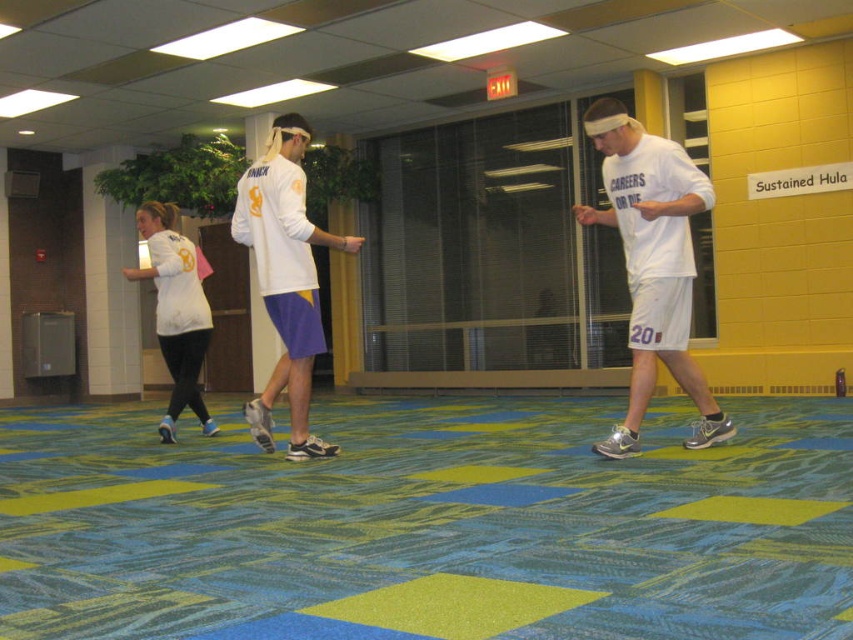
Question: Estimate the real-world distances between objects in this image. Which object is closer to the white matte shirt at left?

Choices:
 (A) white matte jersey at center
 (B) white matte shorts at center

Answer: (A)

Question: Does white matte shorts at center appear on the left side of white matte shirt at left?

Choices:
 (A) no
 (B) yes

Answer: (A)

Question: Which of the following is the closest to the observer?

Choices:
 (A) click(306, 332)
 (B) click(161, 323)

Answer: (A)

Question: Does white matte shorts at center have a smaller size compared to white matte jersey at center?

Choices:
 (A) no
 (B) yes

Answer: (B)

Question: Does white matte jersey at center appear under white matte shirt at left?

Choices:
 (A) no
 (B) yes

Answer: (A)

Question: Estimate the real-world distances between objects in this image. Which object is closer to the white matte shirt at left?

Choices:
 (A) white matte shorts at center
 (B) white matte jersey at center

Answer: (B)